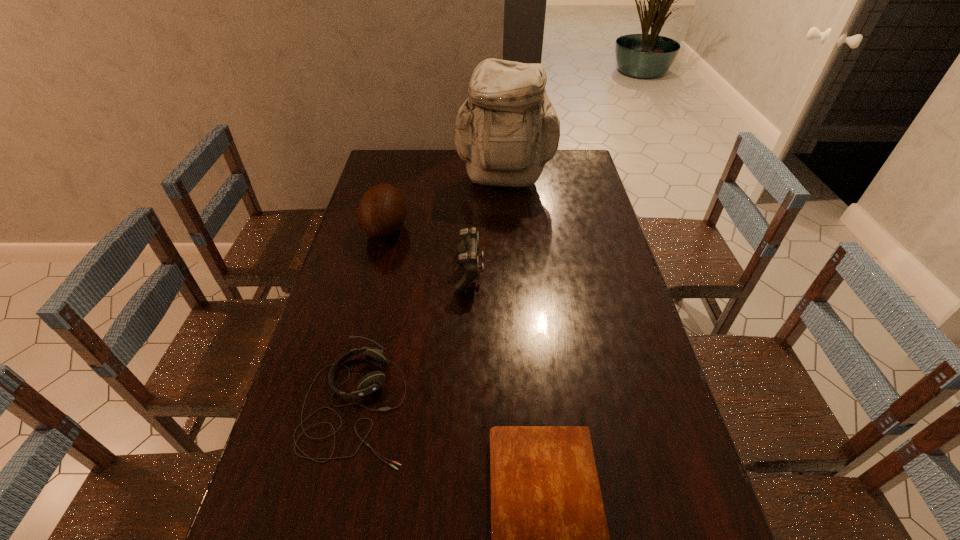
The width and height of the screenshot is (960, 540). Find the location of `football present at the left edge`. football present at the left edge is located at coordinates (381, 211).

At what (x,y) coordinates should I click in order to perform the action: click on headset located at the left edge. Please return your answer as a coordinate pair (x, y). The height and width of the screenshot is (540, 960). Looking at the image, I should click on (371, 382).

At what (x,y) coordinates should I click in order to perform the action: click on object that is at the right edge. Please return your answer as a coordinate pair (x, y). This screenshot has width=960, height=540. Looking at the image, I should click on (507, 130).

Identify the location of object at the far right corner. The image size is (960, 540). (507, 130).

In the image, there is a desktop. Identify the location of vacant space at the left edge. This screenshot has width=960, height=540. (361, 264).

Identify the location of vacant space at the right edge. (635, 310).

The image size is (960, 540). I want to click on vacant position at the far left corner of the desktop, so click(403, 151).

Find the location of `unoccupied position between the football and the headset`. unoccupied position between the football and the headset is located at coordinates (371, 317).

The width and height of the screenshot is (960, 540). I want to click on vacant area that lies between the second shortest object and the backpack, so click(x=430, y=294).

Locate an element on the screen. This screenshot has height=540, width=960. free space between the farthest object and the fourth shortest object is located at coordinates (445, 206).